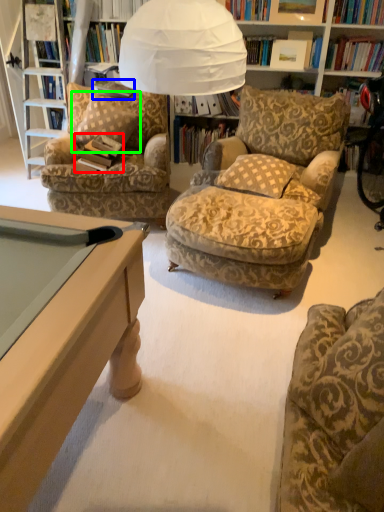
Question: Which is farther away from book (highlighted by a red box)? book (highlighted by a blue box) or pillow (highlighted by a green box)?

Choices:
 (A) book
 (B) pillow

Answer: (A)